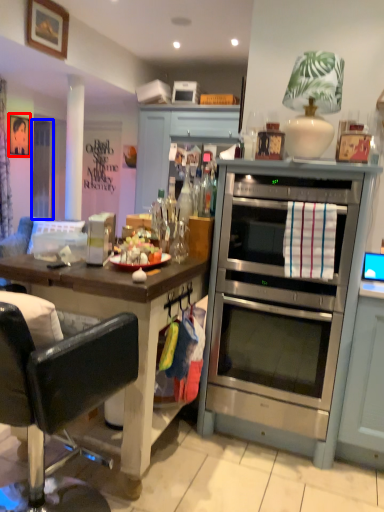
Question: Which object appears closest to the camera in this image, picture frame (highlighted by a red box) or glass door (highlighted by a blue box)?

Choices:
 (A) picture frame
 (B) glass door

Answer: (A)